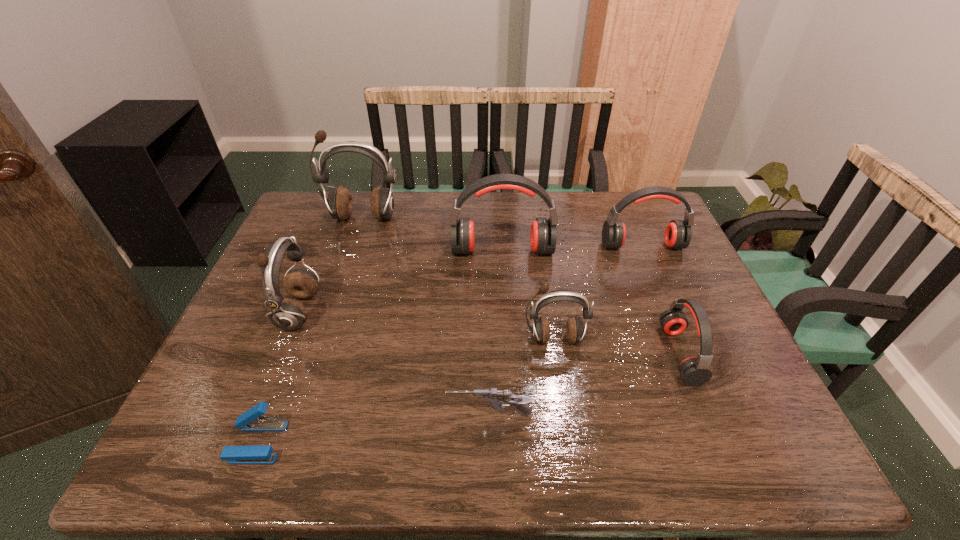
Locate an element on the screen. The width and height of the screenshot is (960, 540). free space at the right edge of the desktop is located at coordinates (718, 400).

The image size is (960, 540). In order to click on free space at the far right corner in this screenshot , I will do `click(649, 208)`.

Locate an element on the screen. vacant space at the near right corner of the desktop is located at coordinates (745, 437).

Identify the location of empty space between the stapler and the gun. The height and width of the screenshot is (540, 960). (373, 429).

Identify the location of unoccupied position between the farthest earphone and the second smallest red earphone. (502, 232).

This screenshot has width=960, height=540. I want to click on blank region between the gun and the stapler, so click(x=373, y=429).

The height and width of the screenshot is (540, 960). I want to click on vacant space in between the stapler and the rightmost brown earphone, so click(x=406, y=390).

Where is `free space between the second biggest brown earphone and the tallest object`? This screenshot has height=540, width=960. free space between the second biggest brown earphone and the tallest object is located at coordinates (330, 265).

Image resolution: width=960 pixels, height=540 pixels. I want to click on unoccupied position between the second smallest brown earphone and the biggest red earphone, so click(x=400, y=281).

Identify the location of vacant area between the second biggest brown earphone and the biggest red earphone. (400, 281).